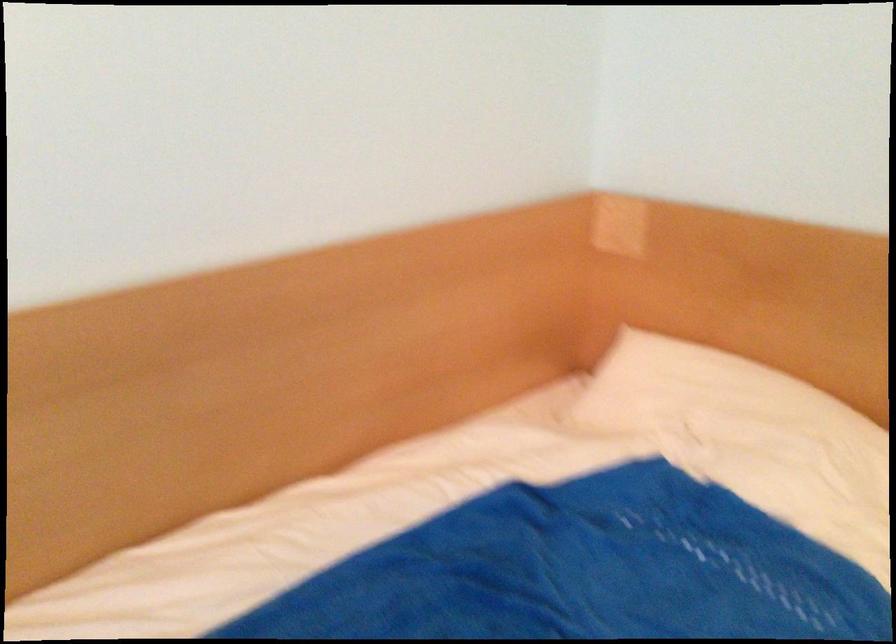
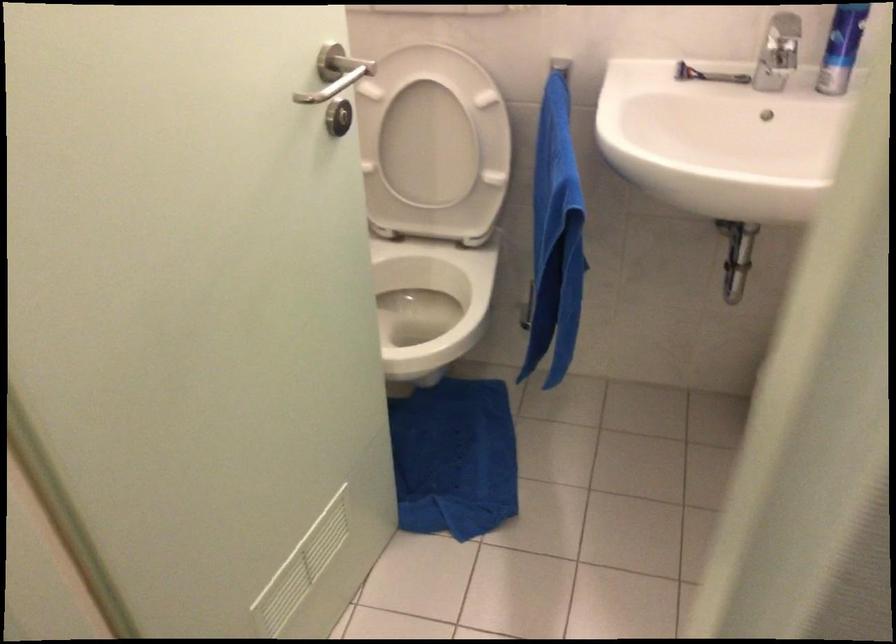
Question: I am providing you with two images of the same scene from different viewpoints. Please identify which objects are invisible in image2.

Choices:
 (A) faucet handle
 (B) dark glass jar
 (C) white toilet seat
 (D) white pillow

Answer: (D)